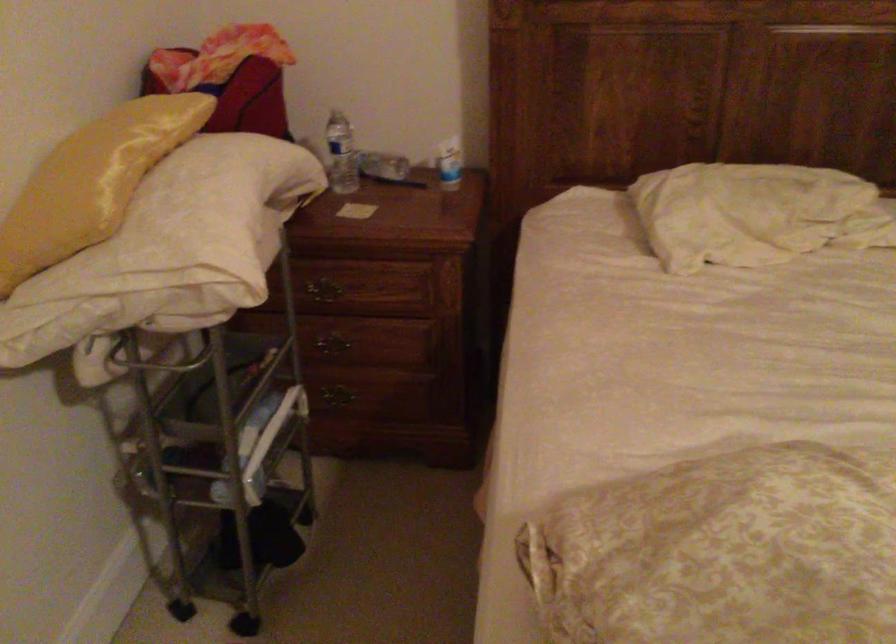
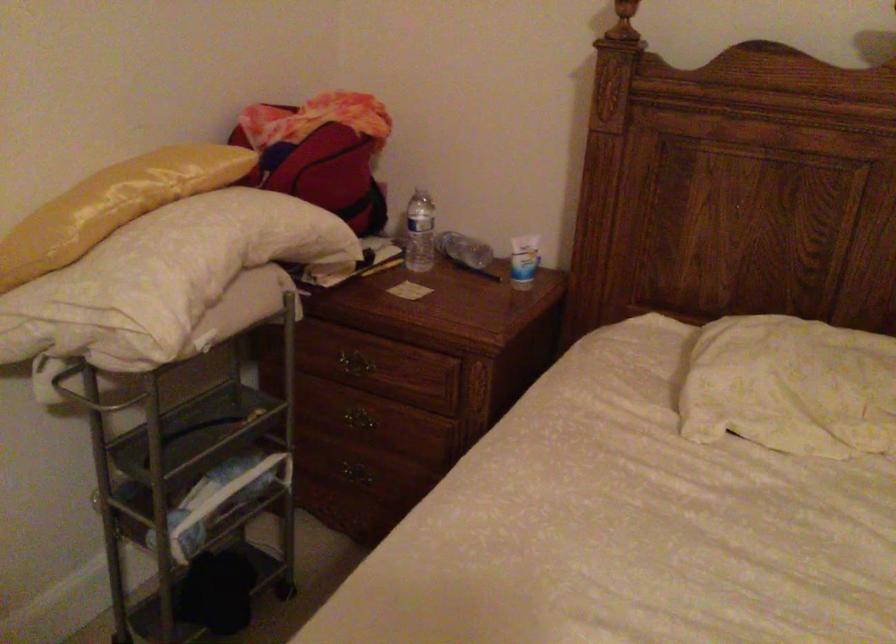
The images are taken continuously from a first-person perspective. In which direction are you moving?

The movement direction of the cameraman is right, forward.